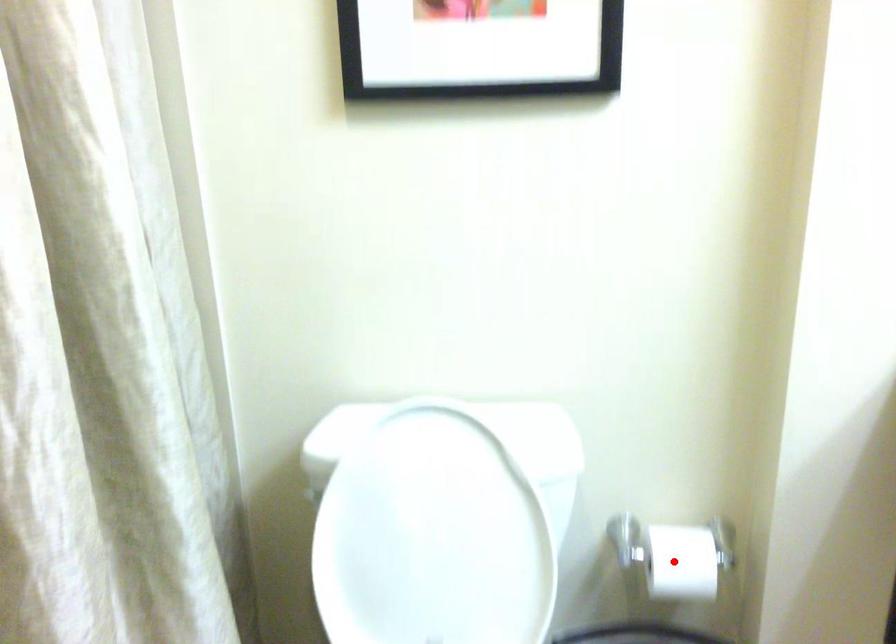
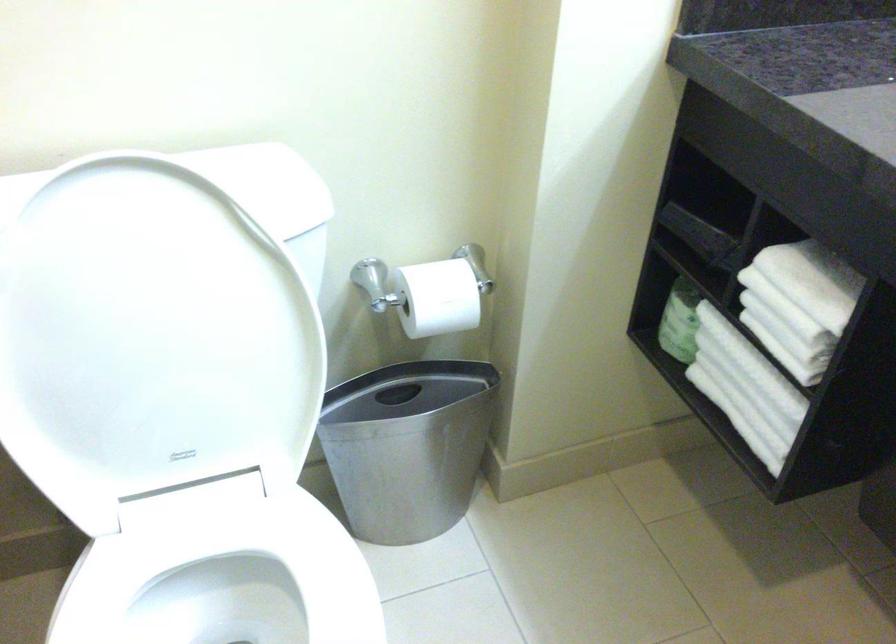
Question: I am providing you with two images of the same scene from different viewpoints. A red point is shown in image1. For the corresponding object point in image2, is it positioned nearer or farther from the camera?

Choices:
 (A) Nearer
 (B) Farther

Answer: (A)